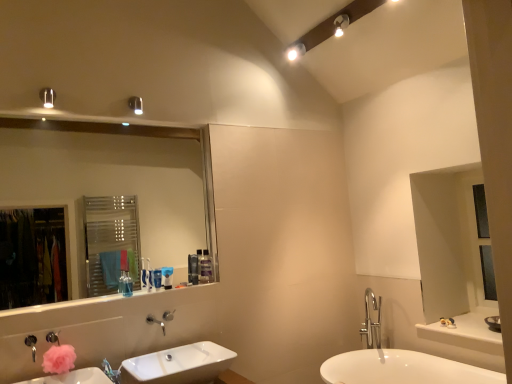
The height and width of the screenshot is (384, 512). I want to click on free point above clear glass mirror at upper left (from a real-world perspective), so click(80, 122).